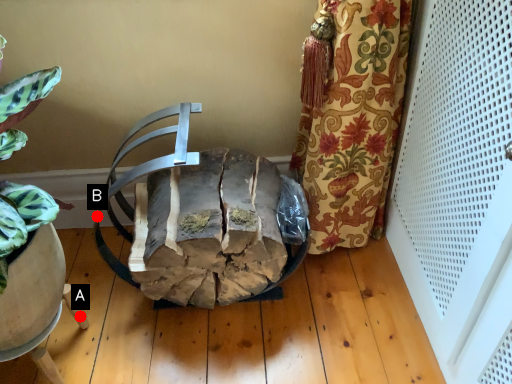
Question: Two points are circled on the image, labeled by A and B beside each circle. Which point is farther to the camera?

Choices:
 (A) A is further
 (B) B is further

Answer: (B)